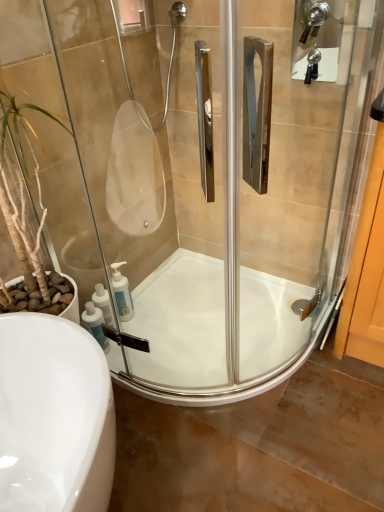
Describe the element at coordinates (122, 293) in the screenshot. I see `white plastic soap dispenser at lower left, acting as the second soap dispenser starting from the front` at that location.

What is the approximate width of satin nickel faucet at upper right?

3.26 inches.

The width and height of the screenshot is (384, 512). I want to click on satin nickel faucet at upper right, so click(x=316, y=39).

Locate an element on the screen. transparent glass shower door at center is located at coordinates (213, 181).

Would you consider transparent glass shower door at center to be distant from white plastic soap dispenser at lower left, acting as the second soap dispenser starting from the front?

transparent glass shower door at center is actually quite close to white plastic soap dispenser at lower left, acting as the second soap dispenser starting from the front.

Is transparent glass shower door at center facing away from white plastic soap dispenser at lower left, acting as the second soap dispenser starting from the front?

That's right, transparent glass shower door at center is facing away from white plastic soap dispenser at lower left, acting as the second soap dispenser starting from the front.

Is point (237, 317) closer or farther from the camera than point (126, 301)?

Clearly, point (237, 317) is closer to the camera than point (126, 301).

Is satin nickel faucet at upper right not inside transparent glass shower door at center?

Absolutely, satin nickel faucet at upper right is external to transparent glass shower door at center.

Can you tell me how much satin nickel faucet at upper right and transparent glass shower door at center differ in facing direction?

There is a 0.201-degree angle between the facing directions of satin nickel faucet at upper right and transparent glass shower door at center.

Is satin nickel faucet at upper right positioned far away from transparent glass shower door at center?

They are positioned close to each other.

From the image's perspective, would you say satin nickel faucet at upper right is positioned over transparent glass shower door at center?

Yes, from the image's perspective, satin nickel faucet at upper right is above transparent glass shower door at center.

Considering the relative positions of white glossy bath at center and white plastic soap dispenser at lower left, which is the second soap dispenser in back-to-front order, in the image provided, is white glossy bath at center to the left or to the right of white plastic soap dispenser at lower left, which is the second soap dispenser in back-to-front order,?

Based on their positions, white glossy bath at center is located to the right of white plastic soap dispenser at lower left, which is the second soap dispenser in back-to-front order.

Considering the relative positions of white glossy bath at center and white plastic soap dispenser at lower left, which is the 1th soap dispenser in front-to-back order, in the image provided, is white glossy bath at center behind white plastic soap dispenser at lower left, which is the 1th soap dispenser in front-to-back order,?

No, white glossy bath at center is closer to the camera.

Which of these two, white glossy bath at center or white plastic soap dispenser at lower left, which is the second soap dispenser in back-to-front order, is smaller?

white plastic soap dispenser at lower left, which is the second soap dispenser in back-to-front order.

From a real-world perspective, is white glossy bath at center over white plastic soap dispenser at lower left, which is the 1th soap dispenser in front-to-back order?

No.

From a real-world perspective, between satin nickel faucet at upper right and white plastic soap dispenser at lower left, the first soap dispenser from the back, who is vertically higher?

satin nickel faucet at upper right, from a real-world perspective.

Locate an element on the screen. The image size is (384, 512). the 1st soap dispenser counting from the left side of the satin nickel faucet at upper right is located at coordinates [x=122, y=293].

Between satin nickel faucet at upper right and white plastic soap dispenser at lower left, the first soap dispenser from the back, which one appears on the right side from the viewer's perspective?

From the viewer's perspective, satin nickel faucet at upper right appears more on the right side.

Is satin nickel faucet at upper right further to the viewer compared to white plastic soap dispenser at lower left, the first soap dispenser from the back?

No, satin nickel faucet at upper right is closer to the camera.

Is white glossy bath at center oriented towards satin nickel faucet at upper right?

No.

From the image's perspective, which is below, white glossy bath at center or satin nickel faucet at upper right?

white glossy bath at center, from the image's perspective.

Considering the sizes of objects white glossy bath at center and satin nickel faucet at upper right in the image provided, who is wider, white glossy bath at center or satin nickel faucet at upper right?

white glossy bath at center.

Is transparent glass shower door at center directly adjacent to satin nickel faucet at upper right?

No, transparent glass shower door at center is not touching satin nickel faucet at upper right.

Who is smaller, transparent glass shower door at center or satin nickel faucet at upper right?

satin nickel faucet at upper right.

Considering the points (117, 82) and (300, 1), which point is in front, point (117, 82) or point (300, 1)?

The point (117, 82) is more forward.

Consider the image. From a real-world perspective, is white glossy bath at center physically below transparent glass shower door at center?

Yes, from a real-world perspective, white glossy bath at center is below transparent glass shower door at center.

What's the angular difference between white glossy bath at center and transparent glass shower door at center's facing directions?

The angle between the facing direction of white glossy bath at center and the facing direction of transparent glass shower door at center is 89.2 degrees.

You are a GUI agent. You are given a task and a screenshot of the screen. Output one action in this format:
    pyautogui.click(x=<x>, y=<y>)
    Task: Click on the bath behind the transparent glass shower door at center
    The image size is (384, 512).
    Given the screenshot: What is the action you would take?
    pyautogui.click(x=213, y=332)

Consider the image. Which object is positioned more to the right, white glossy bath at center or transparent glass shower door at center?

From the viewer's perspective, white glossy bath at center appears more on the right side.

From the image's perspective, which soap dispenser is the 1st one below the transparent glass shower door at center? Please provide its 2D coordinates.

[(122, 293)]

Locate an element on the screen. shower located above the transparent glass shower door at center (from the image's perspective) is located at coordinates (316, 39).

Looking at the image, which one is located further to white plastic soap dispenser at lower left, which is the 1th soap dispenser in front-to-back order, transparent glass shower door at center or white plastic soap dispenser at lower left, the first soap dispenser from the back?

Among the two, transparent glass shower door at center is located further to white plastic soap dispenser at lower left, which is the 1th soap dispenser in front-to-back order.

From the image, which object appears to be nearer to white plastic soap dispenser at lower left, which is the second soap dispenser in back-to-front order, white plastic soap dispenser at lower left, the first soap dispenser from the back, or white glossy bath at center?

white plastic soap dispenser at lower left, the first soap dispenser from the back.

When comparing their distances from transparent glass shower door at center, does white plastic soap dispenser at lower left, which is the 1th soap dispenser in front-to-back order, or satin nickel faucet at upper right seem closer?

The object closer to transparent glass shower door at center is white plastic soap dispenser at lower left, which is the 1th soap dispenser in front-to-back order.

Considering their positions, is white glossy bath at center positioned further to transparent glass shower door at center than white plastic soap dispenser at lower left, which is the second soap dispenser in back-to-front order?

The object further to transparent glass shower door at center is white plastic soap dispenser at lower left, which is the second soap dispenser in back-to-front order.

Based on their spatial positions, is satin nickel faucet at upper right or white plastic soap dispenser at lower left, which is the 1th soap dispenser in front-to-back order, further from white plastic soap dispenser at lower left, the first soap dispenser from the back?

The object further to white plastic soap dispenser at lower left, the first soap dispenser from the back, is satin nickel faucet at upper right.

When comparing their distances from satin nickel faucet at upper right, does white plastic soap dispenser at lower left, which is the 1th soap dispenser in front-to-back order, or white plastic soap dispenser at lower left, acting as the second soap dispenser starting from the front, seem further?

Based on the image, white plastic soap dispenser at lower left, which is the 1th soap dispenser in front-to-back order, appears to be further to satin nickel faucet at upper right.

Looking at this image, considering their positions, is white glossy bath at center positioned further to white plastic soap dispenser at lower left, the first soap dispenser from the back, than transparent glass shower door at center?

transparent glass shower door at center lies further to white plastic soap dispenser at lower left, the first soap dispenser from the back, than the other object.

Estimate the real-world distances between objects in this image. Which object is closer to satin nickel faucet at upper right, white glossy bath at center or white plastic soap dispenser at lower left, acting as the second soap dispenser starting from the front?

The object closer to satin nickel faucet at upper right is white glossy bath at center.

I want to click on screen door between satin nickel faucet at upper right and white glossy bath at center in the vertical direction, so click(x=213, y=181).

Where is `soap dispenser located between transparent glass shower door at center and white plastic soap dispenser at lower left, the first soap dispenser from the back, in the depth direction`? soap dispenser located between transparent glass shower door at center and white plastic soap dispenser at lower left, the first soap dispenser from the back, in the depth direction is located at coordinates (95, 324).

The width and height of the screenshot is (384, 512). Find the location of `screen door that lies between satin nickel faucet at upper right and white plastic soap dispenser at lower left, which is the second soap dispenser in back-to-front order, from top to bottom`. screen door that lies between satin nickel faucet at upper right and white plastic soap dispenser at lower left, which is the second soap dispenser in back-to-front order, from top to bottom is located at coordinates (213, 181).

At what (x,y) coordinates should I click in order to perform the action: click on shower positioned between transparent glass shower door at center and white plastic soap dispenser at lower left, acting as the second soap dispenser starting from the front, from near to far. Please return your answer as a coordinate pair (x, y). Looking at the image, I should click on (316, 39).